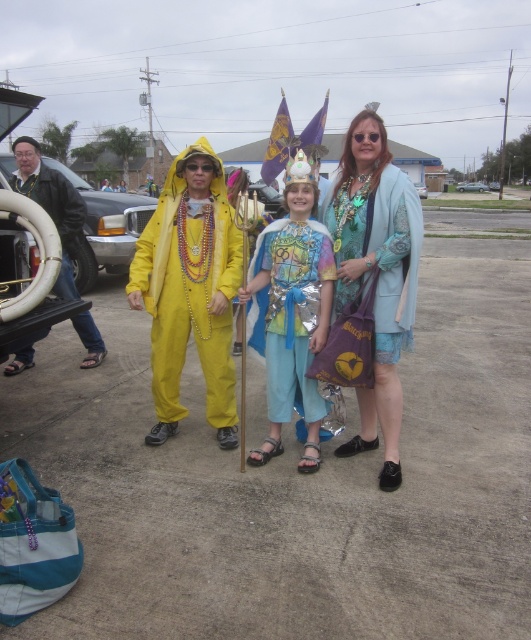
Question: Where is shiny yellow jumpsuit at center located in relation to teal fabric dress at center in the image?

Choices:
 (A) left
 (B) right

Answer: (A)

Question: Which is farther from the metallic silver car at left?

Choices:
 (A) teal fabric dress at center
 (B) shiny yellow jumpsuit at center

Answer: (A)

Question: Can you confirm if shiny yellow jumpsuit at center is positioned below teal fabric dress at center?

Choices:
 (A) no
 (B) yes

Answer: (B)

Question: Among these objects, which one is farthest from the camera?

Choices:
 (A) shiny metallic cape at center
 (B) matte yellow jumpsuit at center
 (C) teal fabric dress at center

Answer: (B)

Question: Which object is positioned farthest from the teal metallic sedan at center?

Choices:
 (A) teal fabric dress at center
 (B) matte yellow jumpsuit at center
 (C) shiny yellow jumpsuit at center

Answer: (C)

Question: Does shiny yellow jumpsuit at center lie in front of metallic silver car at left?

Choices:
 (A) no
 (B) yes

Answer: (B)